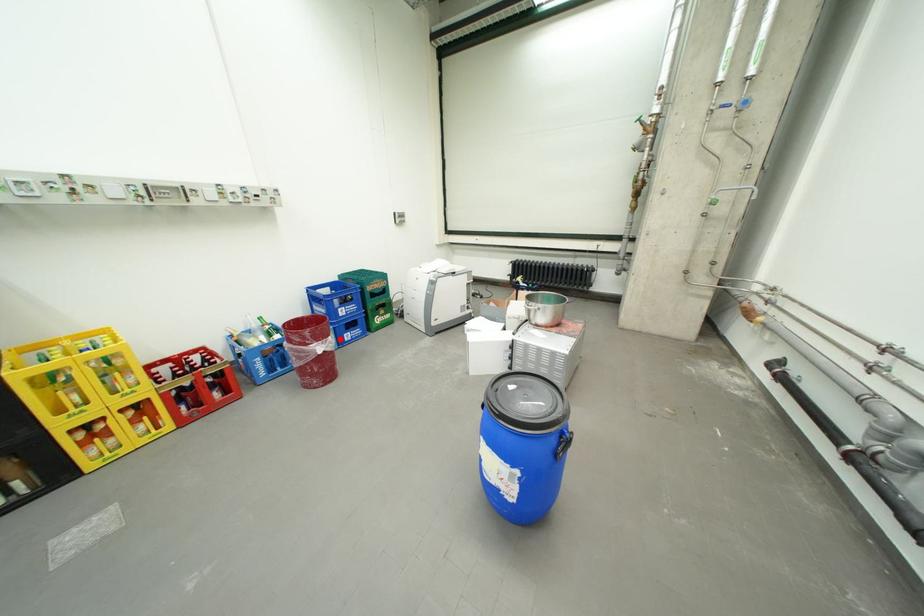
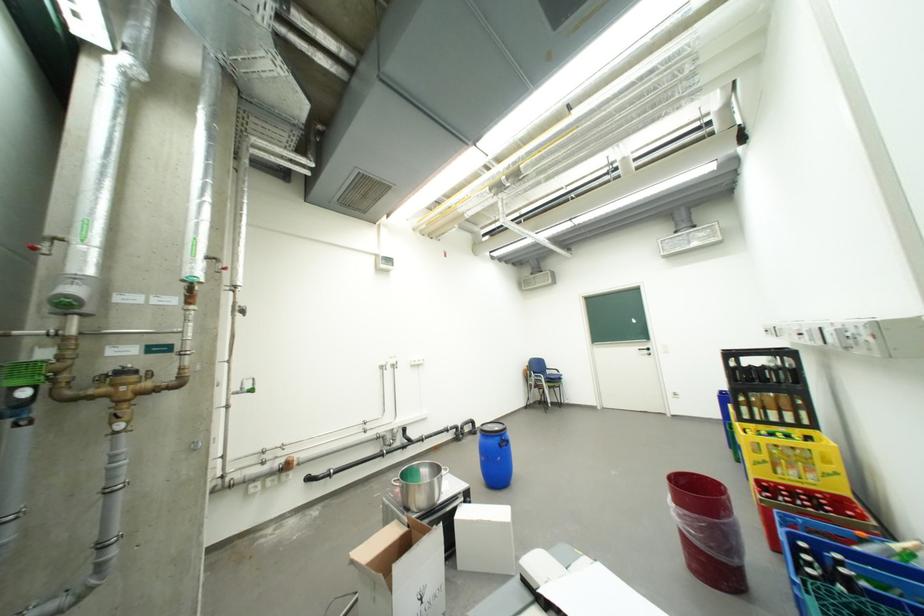
Question: I am providing you with two images of the same scene from different viewpoints. In image1, a red point is highlighted. Considering the same 3D point in image2, which of the following is correct?

Choices:
 (A) It is closer
 (B) It is farther

Answer: (B)